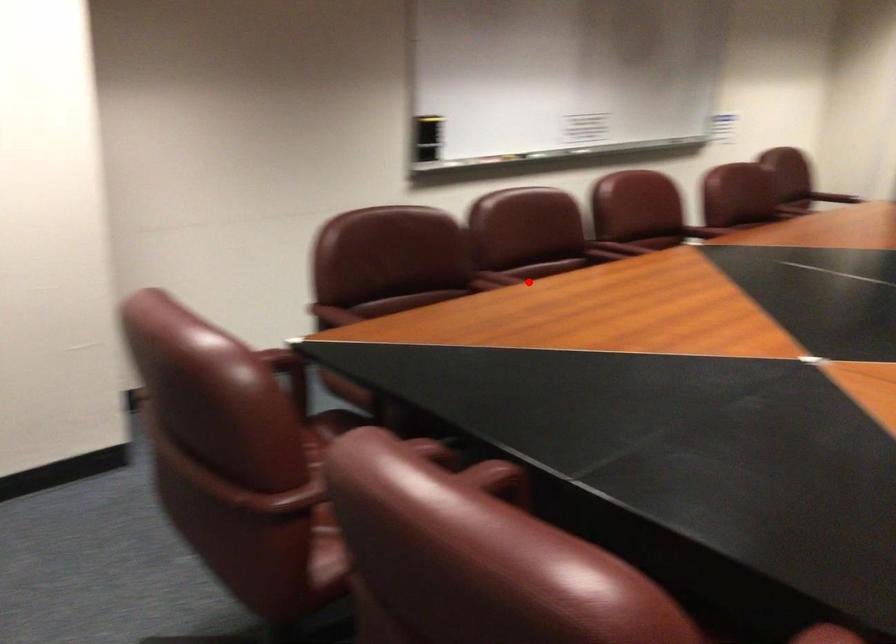
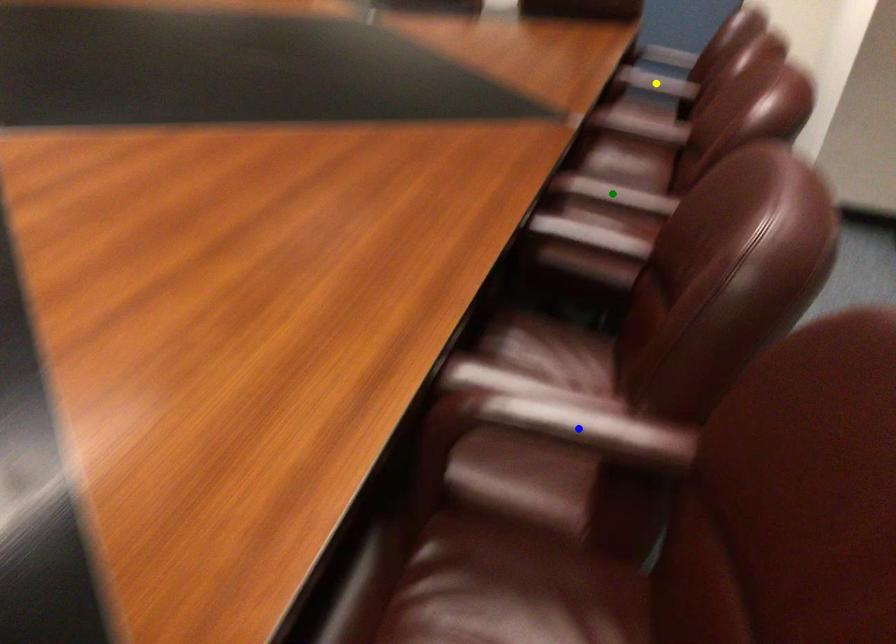
Question: I am providing you with two images of the same scene from different viewpoints. A red point is marked on the first image. You are given multiple points on the second image. Which spot in image 2 lines up with the point in image 1?

Choices:
 (A) yellow point
 (B) blue point
 (C) green point

Answer: (A)